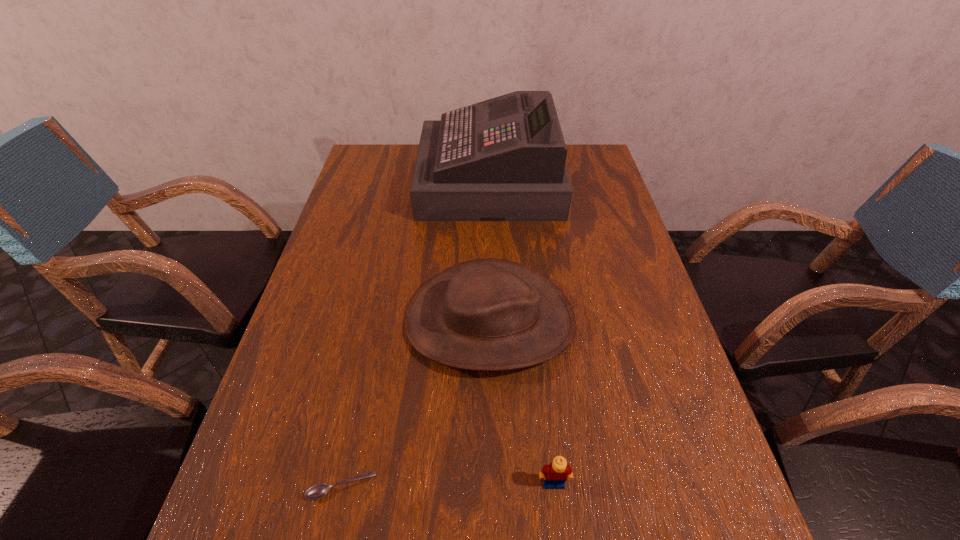
The image size is (960, 540). I want to click on free space located on the back of the soupspoon, so click(373, 336).

Identify the location of object that is at the far edge. The width and height of the screenshot is (960, 540). (503, 159).

You are a GUI agent. You are given a task and a screenshot of the screen. Output one action in this format:
    pyautogui.click(x=<x>, y=<y>)
    Task: Click on the object that is positioned at the left edge
    Image resolution: width=960 pixels, height=540 pixels.
    Given the screenshot: What is the action you would take?
    pyautogui.click(x=317, y=491)

This screenshot has width=960, height=540. In order to click on vacant space at the left edge of the desktop in this screenshot , I will do `click(346, 360)`.

The width and height of the screenshot is (960, 540). In the image, there is a desktop. Find the location of `vacant region at the right edge`. vacant region at the right edge is located at coordinates (630, 440).

Image resolution: width=960 pixels, height=540 pixels. Find the location of `vacant space in between the shortest object and the cowboy hat`. vacant space in between the shortest object and the cowboy hat is located at coordinates (416, 403).

Locate an element on the screen. This screenshot has width=960, height=540. blank region between the second shortest object and the third nearest object is located at coordinates (522, 401).

You are a GUI agent. You are given a task and a screenshot of the screen. Output one action in this format:
    pyautogui.click(x=<x>, y=<y>)
    Task: Click on the free space between the second shortest object and the third shortest object
    
    Given the screenshot: What is the action you would take?
    pyautogui.click(x=522, y=401)

This screenshot has width=960, height=540. In order to click on vacant area that lies between the second farthest object and the second shortest object in this screenshot , I will do `click(522, 401)`.

Find the location of a particular element. The height and width of the screenshot is (540, 960). free space between the cash register and the cowboy hat is located at coordinates (490, 251).